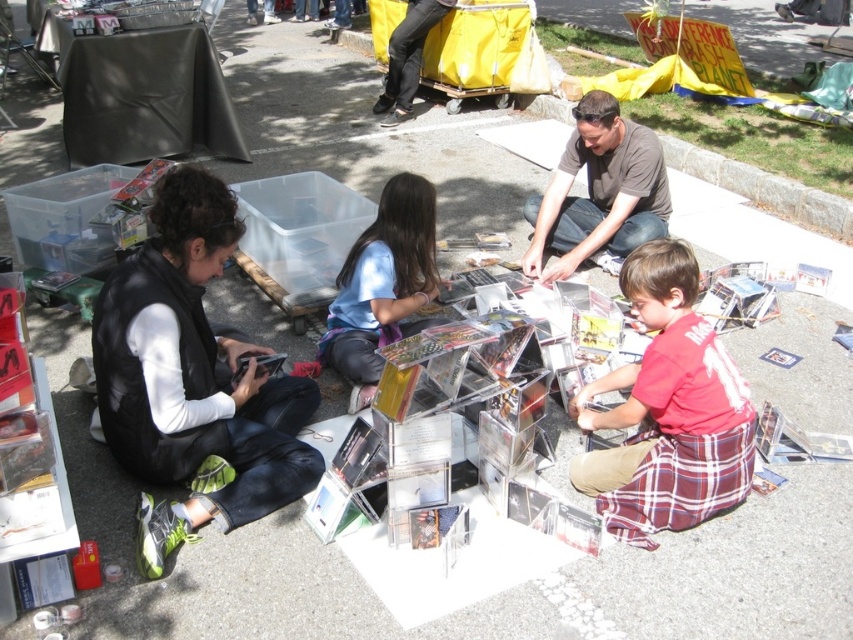
Question: Which point is farther to the camera?

Choices:
 (A) matte brown shirt at center
 (B) black leather vest at lower left
 (C) red plaid shorts at lower right

Answer: (A)

Question: Can you confirm if matte brown shirt at center is thinner than blue matte shirt at center?

Choices:
 (A) no
 (B) yes

Answer: (A)

Question: Can you confirm if black leather vest at lower left is positioned to the right of matte brown shirt at center?

Choices:
 (A) yes
 (B) no

Answer: (B)

Question: Which point is farther to the camera?

Choices:
 (A) (216, 273)
 (B) (708, 324)

Answer: (B)

Question: Which object is farther from the camera taking this photo?

Choices:
 (A) blue matte shirt at center
 (B) black leather vest at lower left

Answer: (A)

Question: Does matte brown shirt at center appear on the left side of blue matte shirt at center?

Choices:
 (A) yes
 (B) no

Answer: (B)